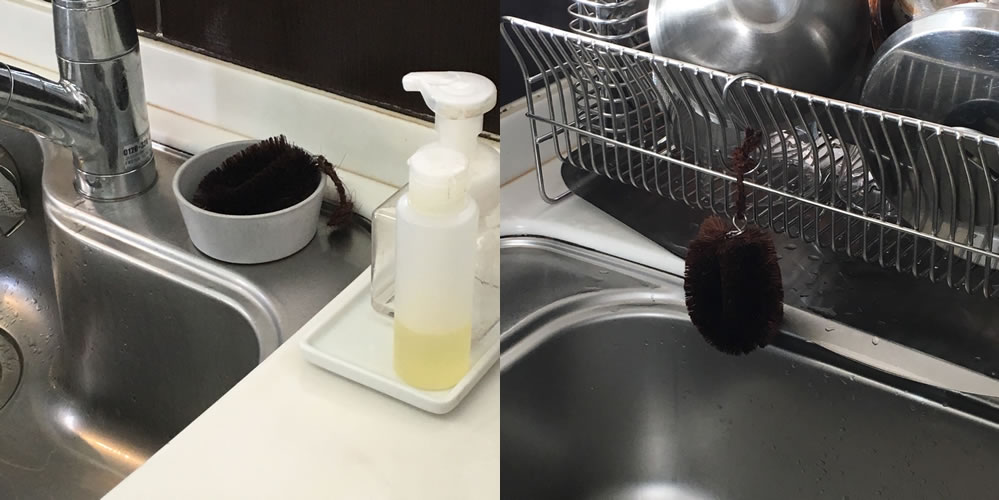
The image size is (999, 500). Identify the location of sponge. (271, 153), (736, 288).